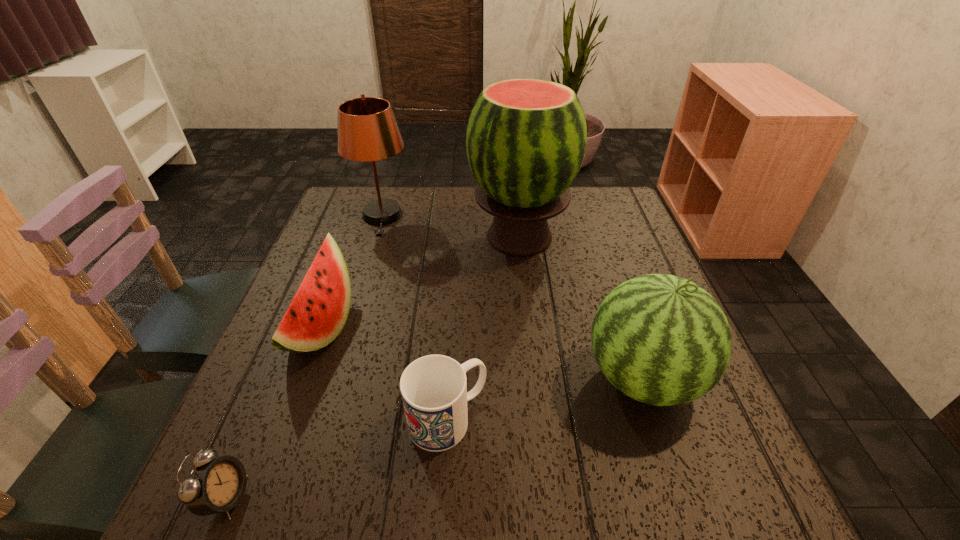
The height and width of the screenshot is (540, 960). In order to click on the farthest watermelon in this screenshot , I will do `click(526, 139)`.

Locate an element on the screen. Image resolution: width=960 pixels, height=540 pixels. lampshade is located at coordinates (367, 130).

Locate an element on the screen. Image resolution: width=960 pixels, height=540 pixels. the third tallest object is located at coordinates (660, 339).

I want to click on the shortest watermelon, so click(x=318, y=312).

Locate an element on the screen. the fourth tallest object is located at coordinates (318, 312).

At what (x,y) coordinates should I click in order to perform the action: click on the second shortest object. Please return your answer as a coordinate pair (x, y). The width and height of the screenshot is (960, 540). Looking at the image, I should click on [x=434, y=392].

I want to click on the shortest object, so click(214, 485).

Locate an element on the screen. the nearest object is located at coordinates (214, 485).

This screenshot has width=960, height=540. What are the coordinates of `free point located 0.130m on the front of the tallest watermelon` in the screenshot? It's located at tap(527, 305).

Locate an element on the screen. The height and width of the screenshot is (540, 960). free space located 0.320m on the front-facing side of the lampshade is located at coordinates (350, 320).